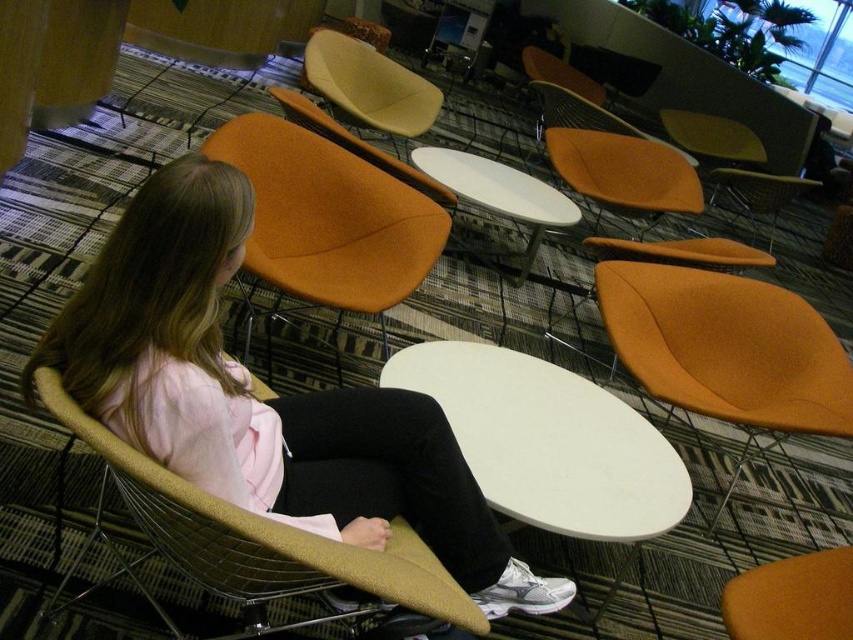
Question: Does white matte round table at center have a smaller size compared to matte orange chair at center-right?

Choices:
 (A) no
 (B) yes

Answer: (B)

Question: Which point is farther from the camera taking this photo?

Choices:
 (A) (160, 444)
 (B) (751, 196)
 (C) (839, 358)

Answer: (B)

Question: Is the position of orange fabric armchair at left more distant than that of white matte table at center?

Choices:
 (A) yes
 (B) no

Answer: (B)

Question: Does matte gold chair at center appear on the right side of beige leather armchair at upper center?

Choices:
 (A) no
 (B) yes

Answer: (B)

Question: Which point appears closest to the camera in this image?

Choices:
 (A) (379, 205)
 (B) (192, 540)
 (C) (755, 339)
 (D) (788, 195)

Answer: (B)

Question: Which object is farther from the camera taking this photo?

Choices:
 (A) white matte round table at center
 (B) beige leather armchair at upper center

Answer: (B)